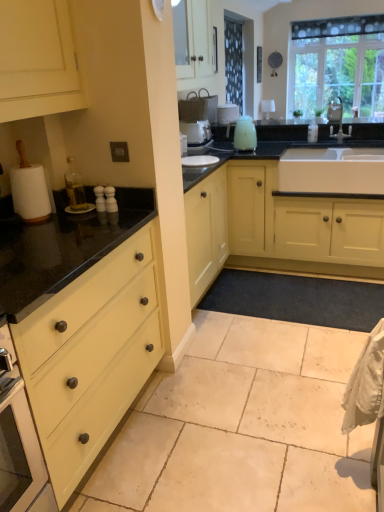
Question: Can you confirm if matte yellow cabinet at center is positioned to the right of beige tile floor at lower center?

Choices:
 (A) yes
 (B) no

Answer: (A)

Question: Considering the relative sizes of matte yellow cabinet at center and beige tile floor at lower center in the image provided, is matte yellow cabinet at center smaller than beige tile floor at lower center?

Choices:
 (A) no
 (B) yes

Answer: (A)

Question: Is matte yellow cabinet at center facing towards beige tile floor at lower center?

Choices:
 (A) yes
 (B) no

Answer: (A)

Question: Is matte yellow cabinet at center far away from beige tile floor at lower center?

Choices:
 (A) yes
 (B) no

Answer: (B)

Question: From the image's perspective, is matte yellow cabinet at center located beneath beige tile floor at lower center?

Choices:
 (A) no
 (B) yes

Answer: (A)

Question: Considering the relative positions of matte yellow cabinet at center and beige tile floor at lower center in the image provided, is matte yellow cabinet at center behind beige tile floor at lower center?

Choices:
 (A) yes
 (B) no

Answer: (A)

Question: From a real-world perspective, is satin nickel faucet at upper right physically above matte yellow cabinet at center?

Choices:
 (A) no
 (B) yes

Answer: (B)

Question: From the image's perspective, does satin nickel faucet at upper right appear higher than matte yellow cabinet at center?

Choices:
 (A) yes
 (B) no

Answer: (A)

Question: Is matte yellow cabinet at center at the back of satin nickel faucet at upper right?

Choices:
 (A) no
 (B) yes

Answer: (A)

Question: Is satin nickel faucet at upper right aimed at matte yellow cabinet at center?

Choices:
 (A) yes
 (B) no

Answer: (B)

Question: Is satin nickel faucet at upper right not near matte yellow cabinet at center?

Choices:
 (A) yes
 (B) no

Answer: (A)

Question: Can you confirm if satin nickel faucet at upper right is positioned to the left of matte yellow cabinet at center?

Choices:
 (A) no
 (B) yes

Answer: (A)

Question: Does beige tile floor at lower center have a smaller size compared to satin nickel faucet at upper right?

Choices:
 (A) no
 (B) yes

Answer: (A)